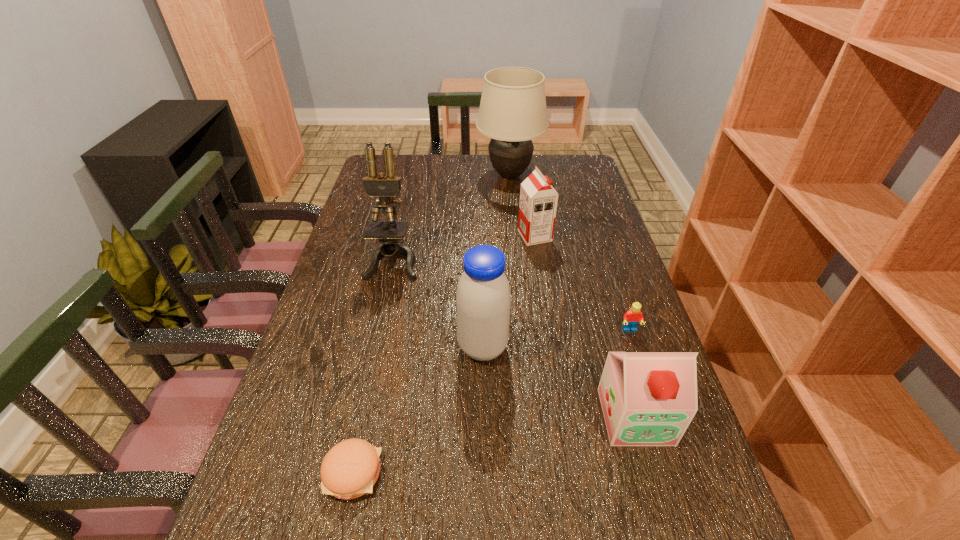
Locate an element on the screen. the farthest object is located at coordinates (512, 112).

The image size is (960, 540). Find the location of `microscope`. microscope is located at coordinates (386, 186).

Find the location of a particular element. Image resolution: width=960 pixels, height=540 pixels. the second nearest soya milk is located at coordinates (483, 299).

Identify the location of the tallest soya milk. (483, 299).

Find the location of a particular element. The height and width of the screenshot is (540, 960). the farthest soya milk is located at coordinates (538, 202).

Locate an element on the screen. The width and height of the screenshot is (960, 540). the nearest soya milk is located at coordinates (648, 398).

Identify the location of Lego. Image resolution: width=960 pixels, height=540 pixels. (632, 317).

The height and width of the screenshot is (540, 960). What are the coordinates of `the shortest object` in the screenshot? It's located at (350, 469).

Where is `free spot located on the left of the lampshade`? This screenshot has width=960, height=540. free spot located on the left of the lampshade is located at coordinates (419, 175).

I want to click on vacant space located 0.130m at the eyepieces of the microscope, so click(381, 315).